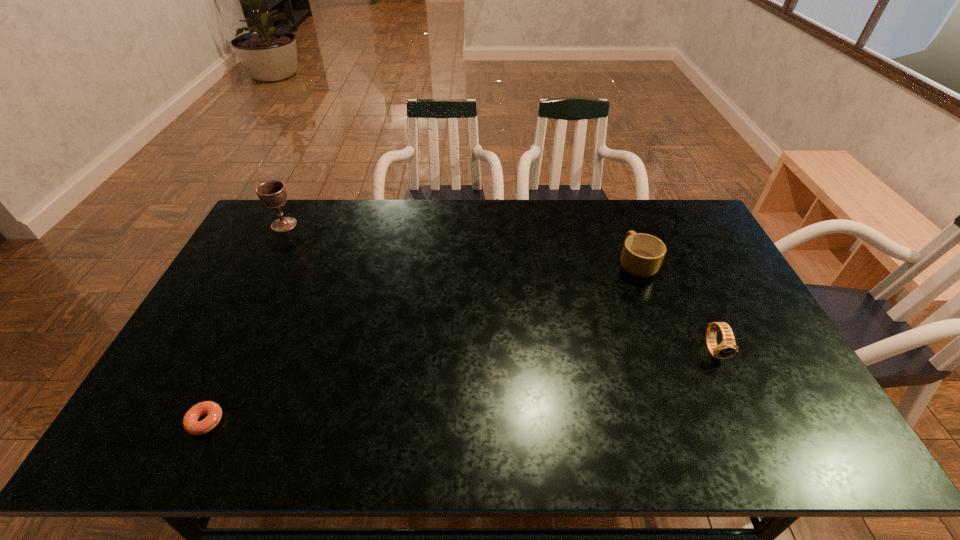
Identify the location of free space located on the side with the handle of the third object from left to right. The width and height of the screenshot is (960, 540). (614, 205).

Where is `free spot located 0.110m on the side with the handle of the third object from left to right`? The height and width of the screenshot is (540, 960). free spot located 0.110m on the side with the handle of the third object from left to right is located at coordinates (623, 228).

Where is `blank space located on the face of the second nearest object`? The image size is (960, 540). blank space located on the face of the second nearest object is located at coordinates (764, 457).

Find the location of `vacant position located on the back of the shortest object`. vacant position located on the back of the shortest object is located at coordinates (256, 316).

Identify the location of object that is at the far edge. (273, 194).

The image size is (960, 540). In order to click on object situated at the near edge in this screenshot , I will do `click(191, 424)`.

You are a GUI agent. You are given a task and a screenshot of the screen. Output one action in this format:
    pyautogui.click(x=<x>, y=<y>)
    Task: Click on the chalice at the left edge
    
    Given the screenshot: What is the action you would take?
    pyautogui.click(x=273, y=194)

At what (x,y) coordinates should I click in order to perform the action: click on doughnut located at the left edge. Please return your answer as a coordinate pair (x, y). The image size is (960, 540). Looking at the image, I should click on (191, 424).

I want to click on object present at the right edge, so click(727, 348).

The width and height of the screenshot is (960, 540). I want to click on object present at the far left corner, so click(x=273, y=194).